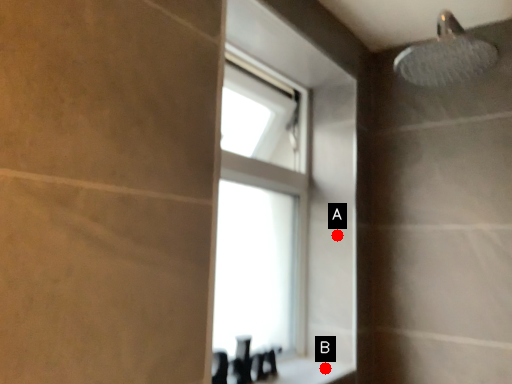
Question: Two points are circled on the image, labeled by A and B beside each circle. Which of the following is the farthest from the observer?

Choices:
 (A) A is further
 (B) B is further

Answer: (A)